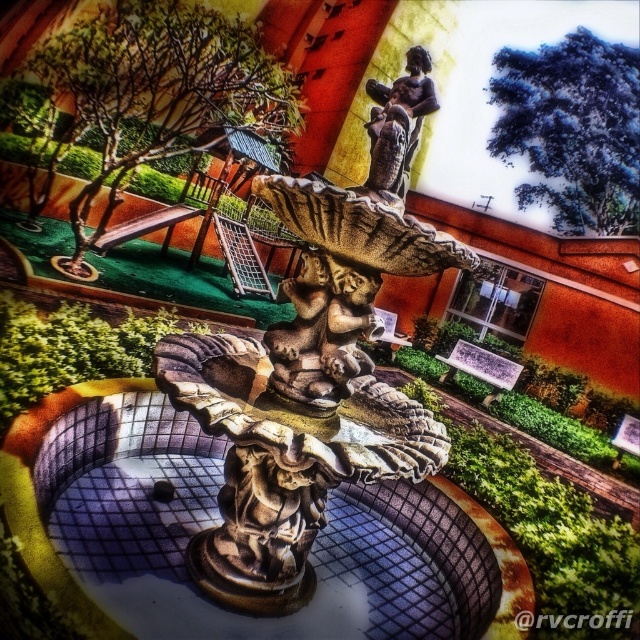
Is stone fountain at center to the left of bronze statue at center from the viewer's perspective?

Indeed, stone fountain at center is positioned on the left side of bronze statue at center.

How far apart are stone fountain at center and bronze statue at center?

1.40 meters

At what (x,y) coordinates should I click in order to perform the action: click on stone fountain at center. Please return your answer as a coordinate pair (x, y). This screenshot has width=640, height=640. Looking at the image, I should click on (83, 468).